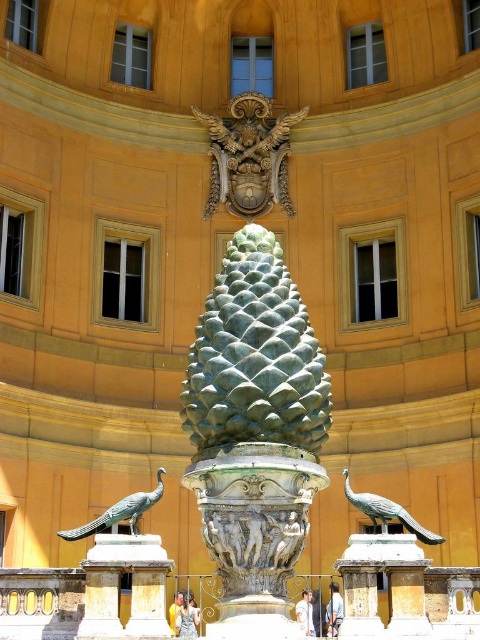
You are a tour guide leading a group near the grand building with golden walls and white windows. You want to point out both the ornate decorative element above the windows and the polished bronze peacock at lower left. How far apart are these two landmarks?

The ornate decorative element above the windows and the polished bronze peacock at lower left are 41.92 meters apart.

You are an art student visiting the site and want to sketch the scene. You need to place the green patina stone pine cone at center and the polished bronze peacock at lower right in your drawing. Based on the spatial relationship between them, where should you position the pine cone relative to the peacock?

The green patina stone pine cone at center is positioned on the left side of the polished bronze peacock at lower right, so you should draw the pine cone to the left of the peacock in your sketch.